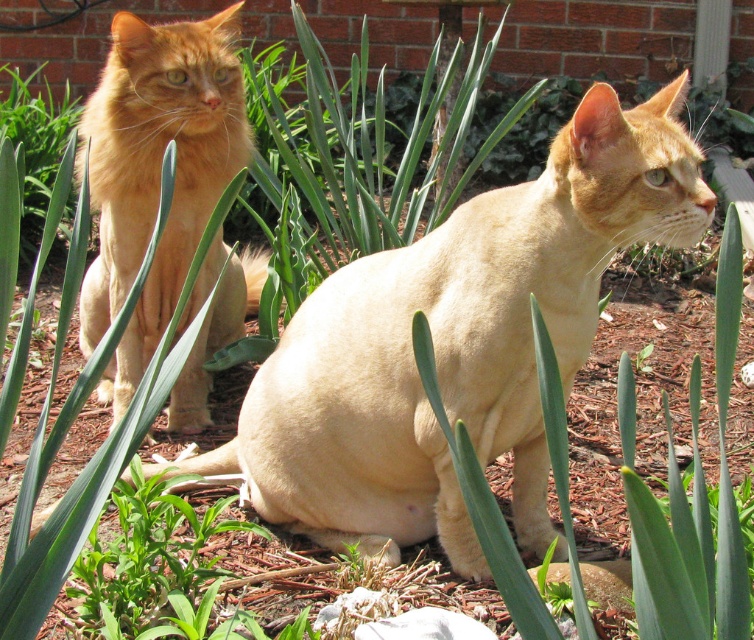
Is point (705, 189) less distant than point (158, 276)?

Yes.

Does point (541, 317) lie in front of point (94, 307)?

Yes.

This screenshot has width=754, height=640. I want to click on matte orange cat at left, so click(x=458, y=342).